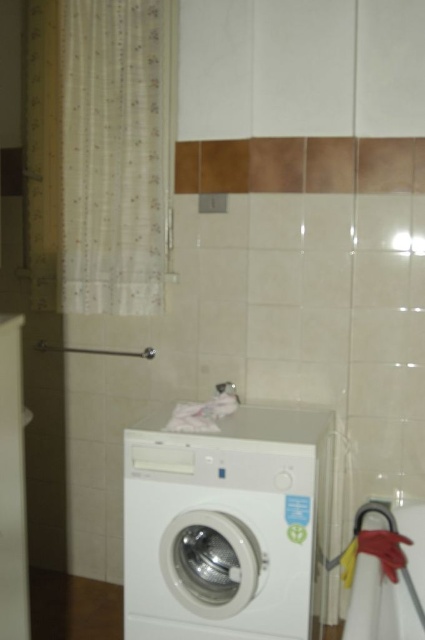
Consider the image. Does white glossy washing machine at center appear under translucent fabric curtain at left?

Yes.

Does white glossy washing machine at center lie behind translucent fabric curtain at left?

No, it is not.

Which is behind, point (285, 548) or point (135, 109)?

Point (135, 109)

This screenshot has width=425, height=640. I want to click on white glossy washing machine at center, so click(226, 525).